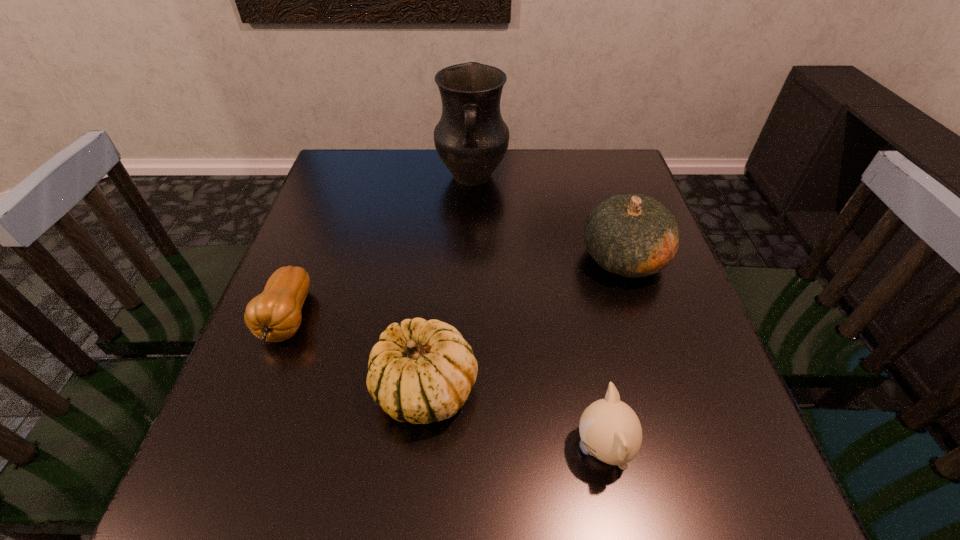
Where is `vacant space in between the rightmost gourd and the second shortest object`? The image size is (960, 540). vacant space in between the rightmost gourd and the second shortest object is located at coordinates (613, 353).

You are a GUI agent. You are given a task and a screenshot of the screen. Output one action in this format:
    pyautogui.click(x=<x>, y=<y>)
    Task: Click on the object that ranks as the second closest to the second shortest object
    Image resolution: width=960 pixels, height=540 pixels.
    Given the screenshot: What is the action you would take?
    pyautogui.click(x=633, y=235)

Locate which object is the fourth closest to the farthest object. Please provide its 2D coordinates. Your answer should be formatted as a tuple, i.e. [(x, y)], where the tuple contains the x and y coordinates of a point satisfying the conditions above.

[(610, 430)]

Identify the location of gourd that can be found as the closest to the shortest object. (420, 371).

Locate an element on the screen. The width and height of the screenshot is (960, 540). gourd object that ranks as the closest to the fourth tallest object is located at coordinates (420, 371).

Where is `vacant space that satisfies the following two spatial constraints: 1. on the stem side of the leftmost object; 2. on the left side of the second gourd from right to left`? This screenshot has height=540, width=960. vacant space that satisfies the following two spatial constraints: 1. on the stem side of the leftmost object; 2. on the left side of the second gourd from right to left is located at coordinates click(260, 389).